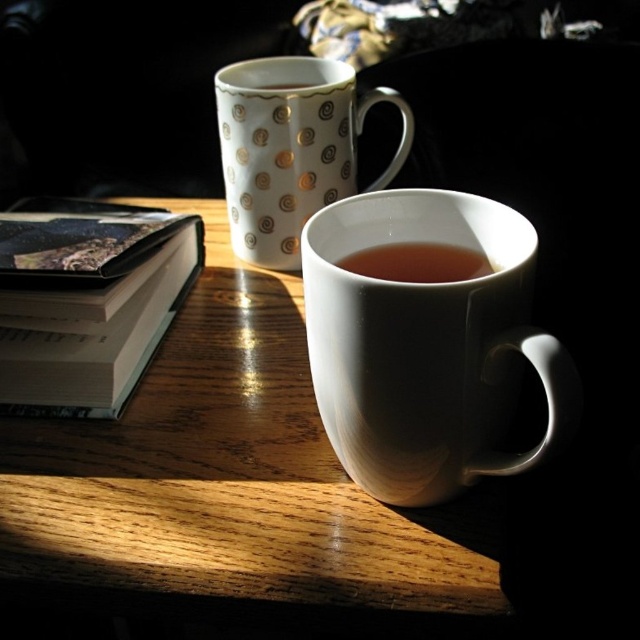
You are organizing items on a wooden table and need to place a hardcover book at left next to the wooden table at center. Can you fit them both on the table if the table has 5 inches of available space?

The wooden table at center and hardcover book at left are 4.04 inches apart from each other. Since the available space is 5 inches, which is more than 4.04 inches, both items can fit on the table.

In the scene shown: What object is located at the coordinates point (426, 346)?

The point (426, 346) corresponds to the white glossy mug at center.